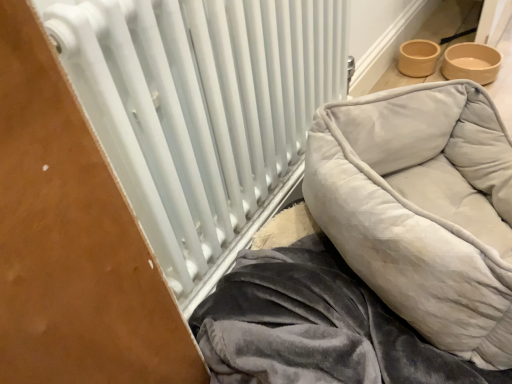
Question: Is white metallic radiator at center turned away from velvet gray pet bed at right?

Choices:
 (A) no
 (B) yes

Answer: (A)

Question: From a real-world perspective, is white metallic radiator at center below velvet gray pet bed at right?

Choices:
 (A) no
 (B) yes

Answer: (A)

Question: Is white metallic radiator at center touching velvet gray pet bed at right?

Choices:
 (A) yes
 (B) no

Answer: (B)

Question: From a real-world perspective, is white metallic radiator at center physically above velvet gray pet bed at right?

Choices:
 (A) yes
 (B) no

Answer: (A)

Question: Is white metallic radiator at center positioned in front of velvet gray pet bed at right?

Choices:
 (A) yes
 (B) no

Answer: (A)

Question: Can you confirm if white metallic radiator at center is shorter than velvet gray pet bed at right?

Choices:
 (A) no
 (B) yes

Answer: (A)

Question: Is velvet gray pet bed at right directly adjacent to white metallic radiator at center?

Choices:
 (A) no
 (B) yes

Answer: (A)

Question: Is velvet gray pet bed at right oriented away from white metallic radiator at center?

Choices:
 (A) no
 (B) yes

Answer: (A)

Question: Does velvet gray pet bed at right have a larger size compared to white metallic radiator at center?

Choices:
 (A) no
 (B) yes

Answer: (B)

Question: Does velvet gray pet bed at right have a lesser width compared to white metallic radiator at center?

Choices:
 (A) no
 (B) yes

Answer: (A)

Question: Considering the relative sizes of velvet gray pet bed at right and white metallic radiator at center in the image provided, is velvet gray pet bed at right shorter than white metallic radiator at center?

Choices:
 (A) yes
 (B) no

Answer: (A)

Question: Is velvet gray pet bed at right at the right side of white metallic radiator at center?

Choices:
 (A) yes
 (B) no

Answer: (A)

Question: Is velvet gray pet bed at right inside or outside of white metallic radiator at center?

Choices:
 (A) outside
 (B) inside

Answer: (A)